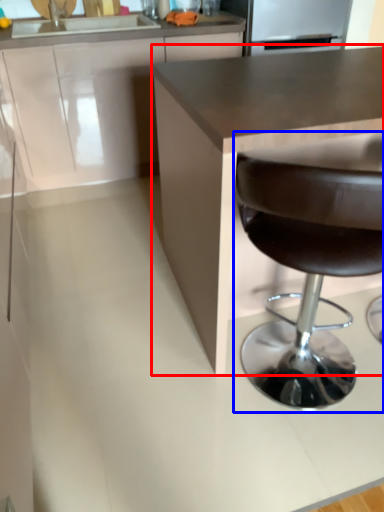
Question: Which object appears closest to the camera in this image, countertop (highlighted by a red box) or chair (highlighted by a blue box)?

Choices:
 (A) countertop
 (B) chair

Answer: (B)